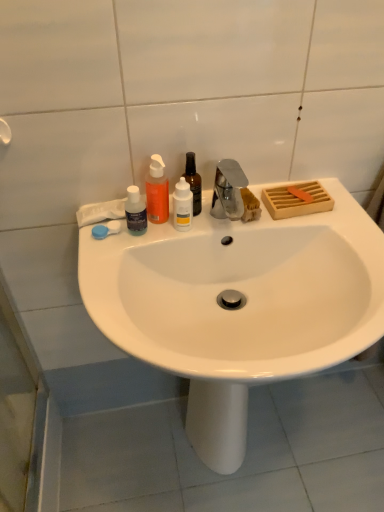
You are a GUI agent. You are given a task and a screenshot of the screen. Output one action in this format:
    pyautogui.click(x=<x>, y=<y>)
    Task: Click on the free spot in front of blue plastic soap at left
    The width and height of the screenshot is (384, 512).
    Given the screenshot: What is the action you would take?
    pyautogui.click(x=102, y=274)